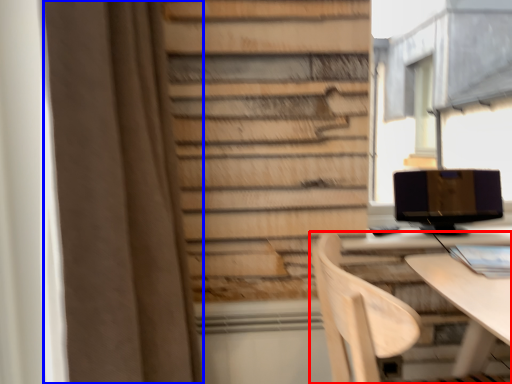
Question: Which of the following is the farthest to the observer, chair (highlighted by a red box) or curtain (highlighted by a blue box)?

Choices:
 (A) chair
 (B) curtain

Answer: (A)